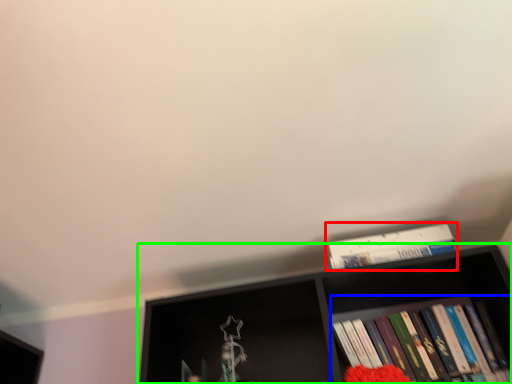
Question: Based on their relative distances, which object is nearer to book (highlighted by a red box)? Choose from book (highlighted by a blue box) and shelf (highlighted by a green box).

Choices:
 (A) book
 (B) shelf

Answer: (B)